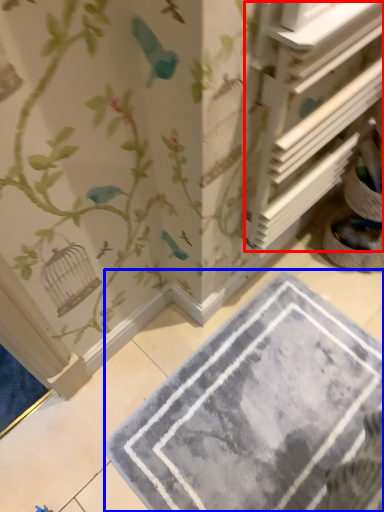
Question: Which point is further to the camera, shelf (highlighted by a red box) or bath mat (highlighted by a blue box)?

Choices:
 (A) shelf
 (B) bath mat

Answer: (B)